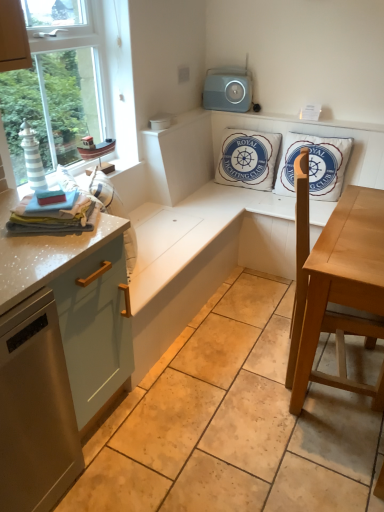
Where is `vacant space in front of light brown wooden table at center`? vacant space in front of light brown wooden table at center is located at coordinates (320, 443).